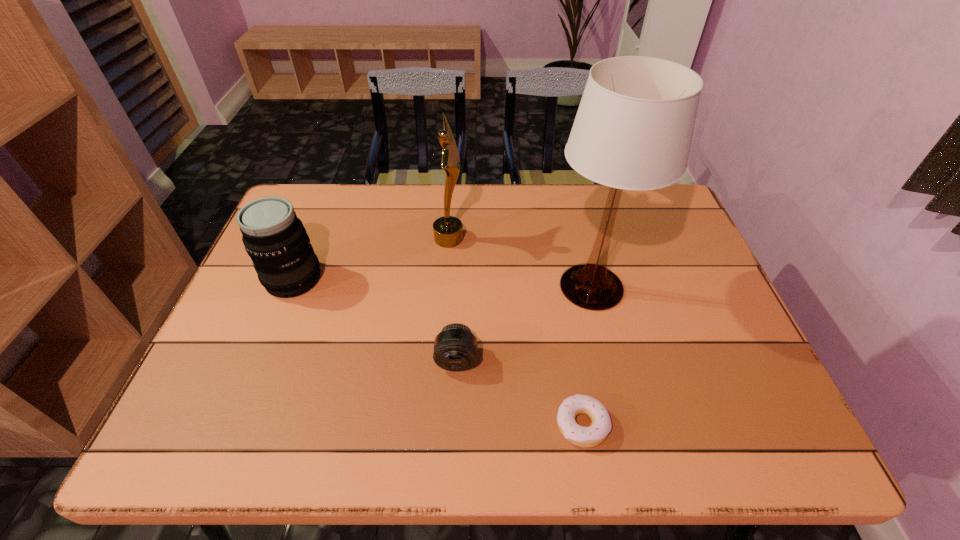
Find the location of a particular element. vacant region located on the front-facing side of the award is located at coordinates (543, 238).

What are the coordinates of `vacant space situated 0.380m on the right of the farther telephoto lens` in the screenshot? It's located at pos(462,279).

What are the coordinates of `vacant position located on the front-facing side of the shorter telephoto lens` in the screenshot? It's located at (453, 450).

This screenshot has width=960, height=540. Find the location of `free space located 0.180m on the back of the doughnut`. free space located 0.180m on the back of the doughnut is located at coordinates 566,334.

The image size is (960, 540). Find the location of `object located at the far edge`. object located at the far edge is located at coordinates (448, 230).

The image size is (960, 540). In order to click on object at the near edge in this screenshot , I will do `click(591, 436)`.

In order to click on object located at the left edge in this screenshot , I will do point(274,237).

Where is `free space at the far edge`? free space at the far edge is located at coordinates (382, 196).

Image resolution: width=960 pixels, height=540 pixels. Identify the location of free space at the near edge of the desktop. (540, 445).

Identify the location of free location at the left edge of the desktop. (276, 352).